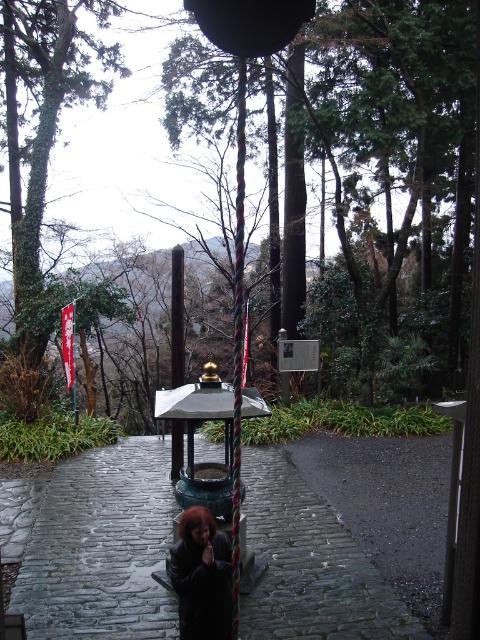
Question: Which object is farther from the camera taking this photo?

Choices:
 (A) dark gray cobblestone path at center
 (B) green patinated metal lantern at center
 (C) green leafy tree at center

Answer: (A)

Question: Is green leafy tree at center wider than green patinated metal lantern at center?

Choices:
 (A) no
 (B) yes

Answer: (B)

Question: Can you confirm if green leafy tree at center is wider than black polished pole at center?

Choices:
 (A) no
 (B) yes

Answer: (B)

Question: Is the position of dark gray cobblestone path at center more distant than that of black polished pole at center?

Choices:
 (A) yes
 (B) no

Answer: (B)

Question: Among these objects, which one is farthest from the camera?

Choices:
 (A) green patinated metal lantern at center
 (B) matte black coat at center
 (C) black polished pole at center

Answer: (C)

Question: Among these points, which one is nearest to the camera?

Choices:
 (A) (194, 166)
 (B) (188, 403)

Answer: (B)